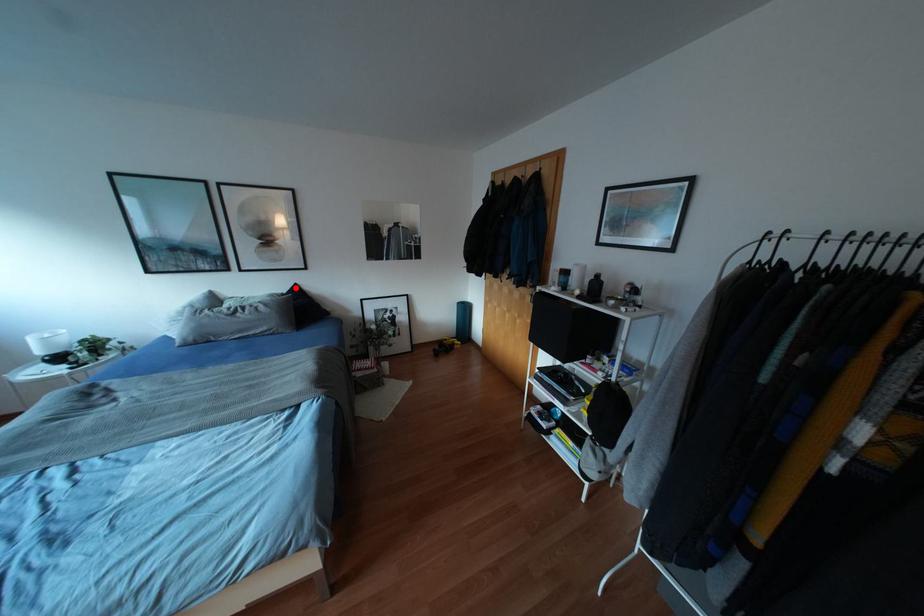
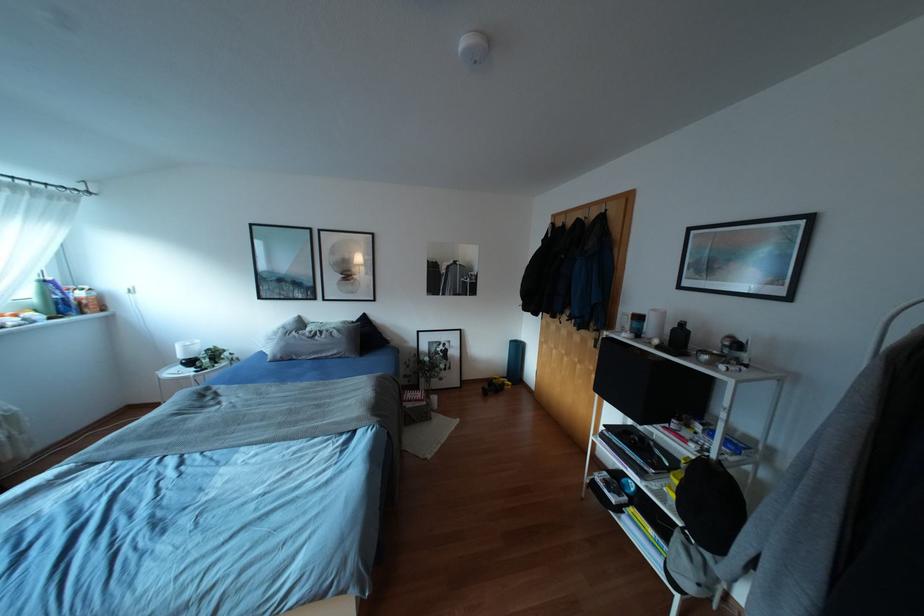
In the second image, find the point that corresponds to the highlighted location in the first image.

(363, 317)